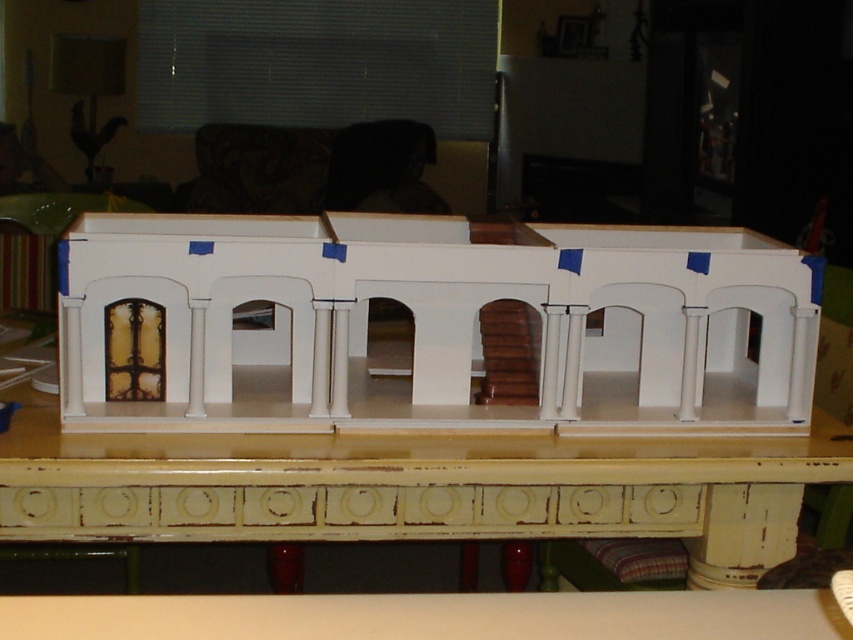
Does white matte building at center appear on the right side of white distressed wood table at center?

Indeed, white matte building at center is positioned on the right side of white distressed wood table at center.

You are a GUI agent. You are given a task and a screenshot of the screen. Output one action in this format:
    pyautogui.click(x=<x>, y=<y>)
    Task: Click on the white matte building at center
    The image size is (853, 640).
    Given the screenshot: What is the action you would take?
    pyautogui.click(x=434, y=324)